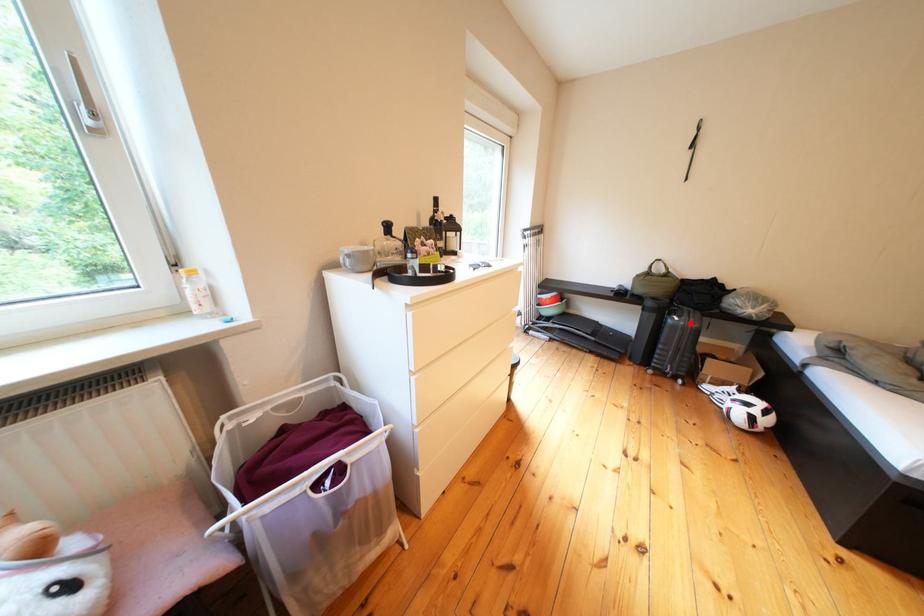
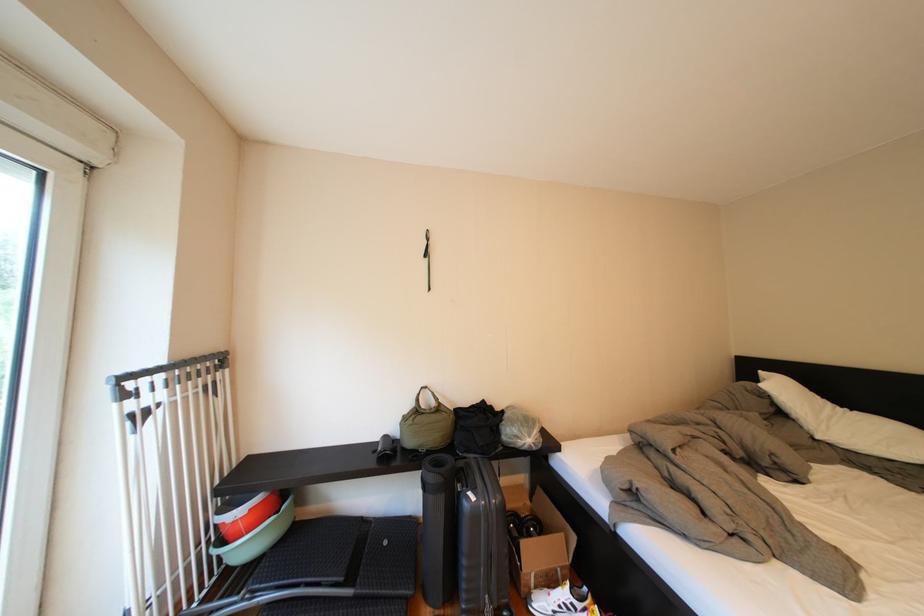
The point at the highlighted location is marked in the first image. Where is the corresponding point in the second image?

(487, 503)